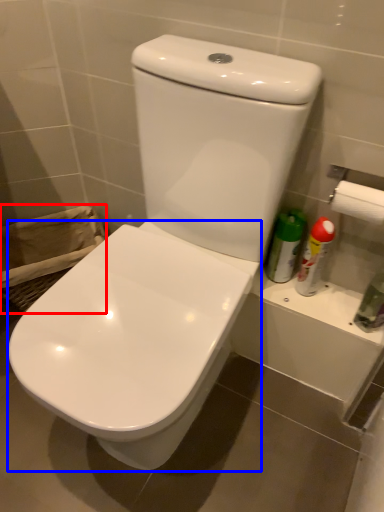
Question: Which object appears closest to the camera in this image, laundry basket (highlighted by a red box) or toilet (highlighted by a blue box)?

Choices:
 (A) laundry basket
 (B) toilet

Answer: (B)